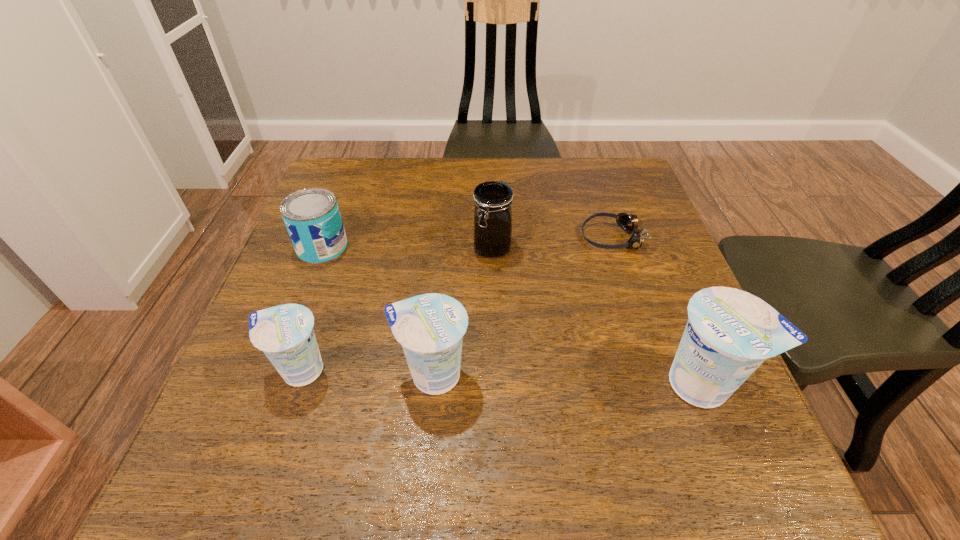
Locate an element on the screen. This screenshot has height=540, width=960. free space located through the lenses of the goggles is located at coordinates (444, 238).

Find the location of a particular element. free space located 0.110m through the lenses of the goggles is located at coordinates (535, 238).

Find the location of a particular element. blank space located through the lenses of the goggles is located at coordinates pyautogui.click(x=477, y=238).

Find the location of a particular element. This screenshot has width=960, height=540. vacant area located on the right of the can is located at coordinates (416, 247).

You are a GUI agent. You are given a task and a screenshot of the screen. Output one action in this format:
    pyautogui.click(x=<x>, y=<y>)
    Task: Click on the vacant region located on the lid of the jar
    The height and width of the screenshot is (540, 960).
    Given the screenshot: What is the action you would take?
    (x=497, y=427)

The height and width of the screenshot is (540, 960). I want to click on yogurt present at the left edge, so click(285, 333).

Locate an element on the screen. can situated at the left edge is located at coordinates (312, 217).

This screenshot has height=540, width=960. I want to click on yogurt that is at the right edge, so click(730, 333).

At what (x,y) coordinates should I click in order to perform the action: click on goggles at the right edge. Please return your answer as a coordinate pair (x, y). Image resolution: width=960 pixels, height=540 pixels. Looking at the image, I should click on (629, 223).

The image size is (960, 540). Find the location of `object that is at the near left corner`. object that is at the near left corner is located at coordinates [x=285, y=333].